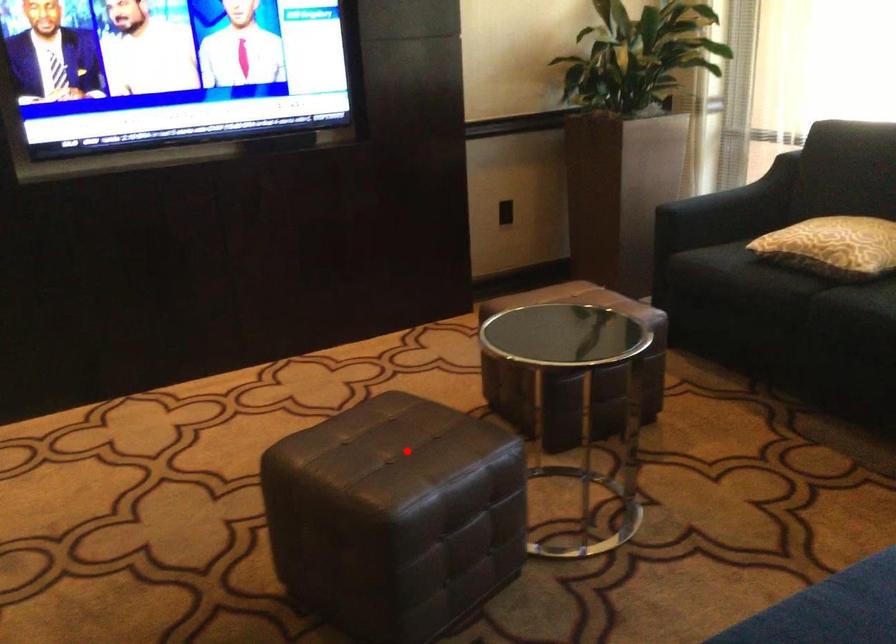
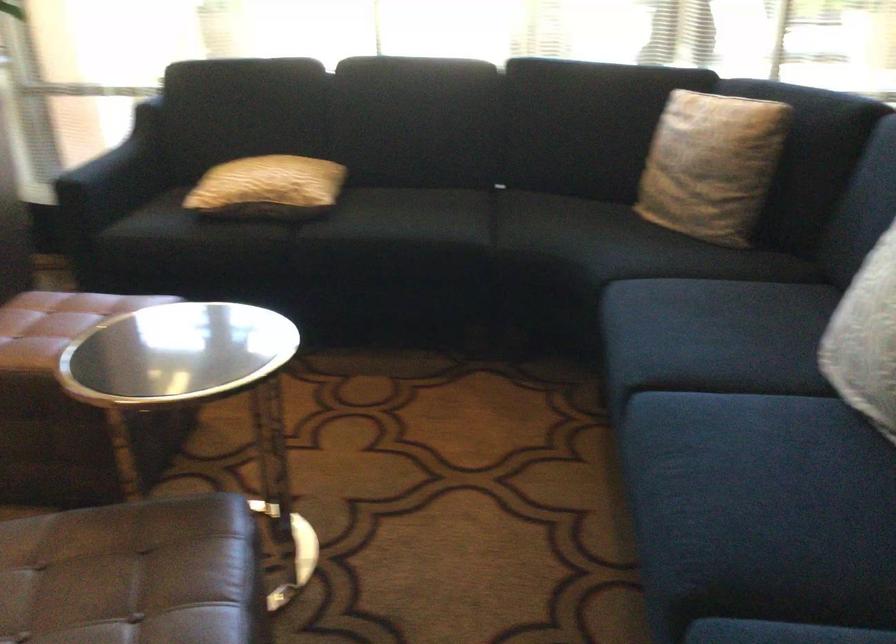
Question: A red point is marked in image1. In image2, is the corresponding 3D point closer to the camera or farther? Reply with the corresponding letter.

Choices:
 (A) The corresponding 3D point is closer.
 (B) The corresponding 3D point is farther.

Answer: (A)